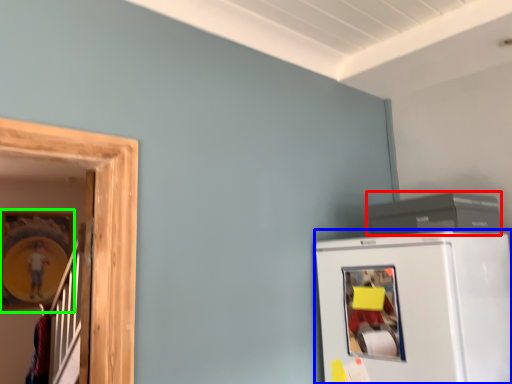
Question: Which object is the closest to the appliance (highlighted by a red box)? Choose among these: refrigerator (highlighted by a blue box) or picture frame (highlighted by a green box).

Choices:
 (A) refrigerator
 (B) picture frame

Answer: (A)